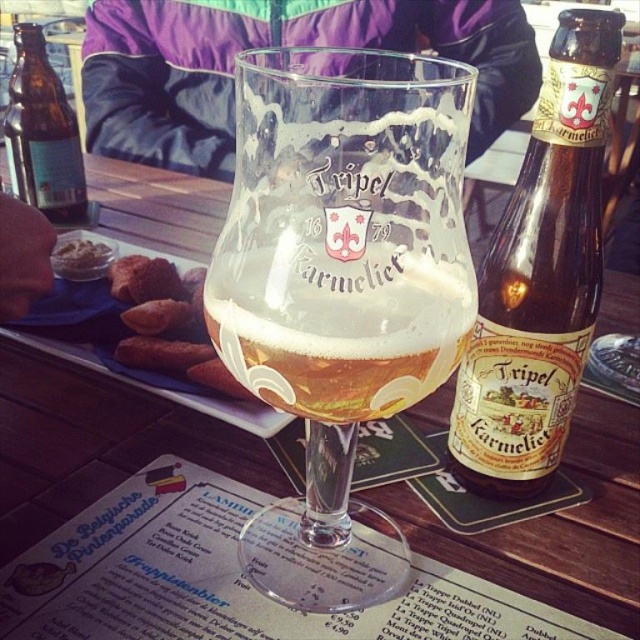
You are a waiter holding a 10 inch long tray. You need to place the tray on the table without moving any items. Can you fit the tray between the white paper menu at center and the edge of the table?

The distance of white paper menu at center from camera is 9.29 inches. Since the tray is 10 inches long, it would not fit between the menu and the edge of the table as the available space is shorter than the tray.

You are standing at the edge of the table and want to place a napkin at the exact center of the table. The table has a coordinate system where the bottom left corner is the origin point. The coordinates of the brown glass bottle at center right are given as point [540,275]. What are the coordinates of the center of the table?

The center of the table would be at coordinates 0.5, 0.5 since the coordinate system starts at the bottom left corner, making the center at the midpoint of both axes.